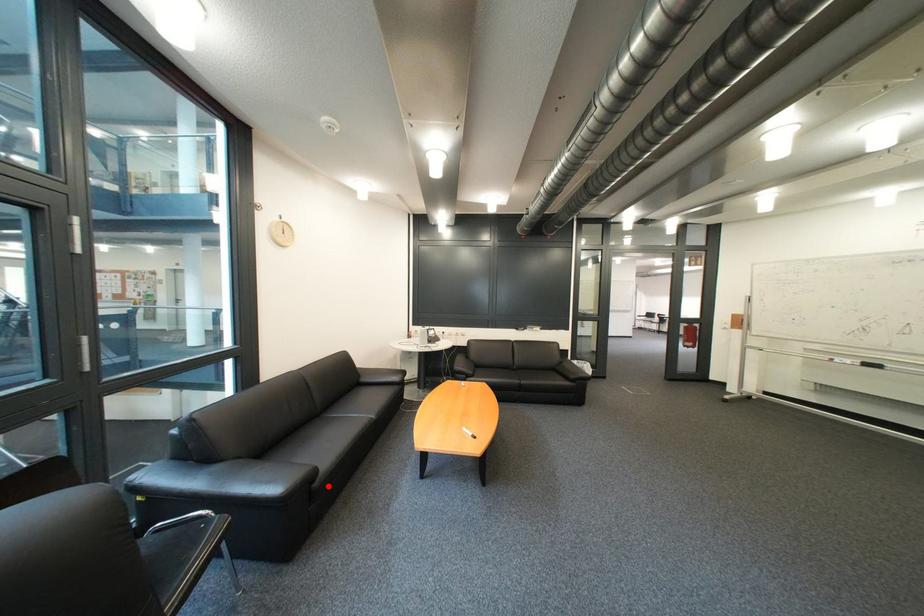
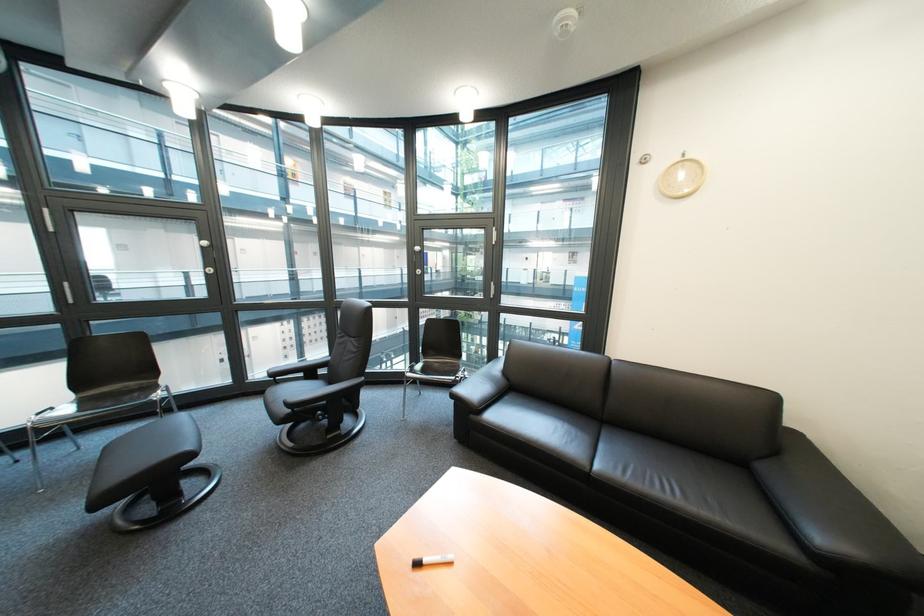
Locate, in the second image, the point that corresponds to the highlighted location in the first image.

(485, 418)